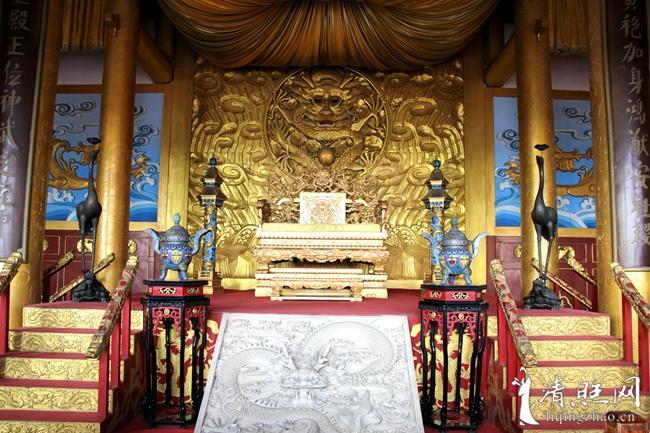
You are a GUI agent. You are given a task and a screenshot of the screen. Output one action in this format:
    pyautogui.click(x=<x>, y=<y>)
    Task: Click on the bannister
    
    Given the screenshot: What is the action you would take?
    pyautogui.click(x=6, y=267), pyautogui.click(x=109, y=305), pyautogui.click(x=502, y=293), pyautogui.click(x=621, y=277)